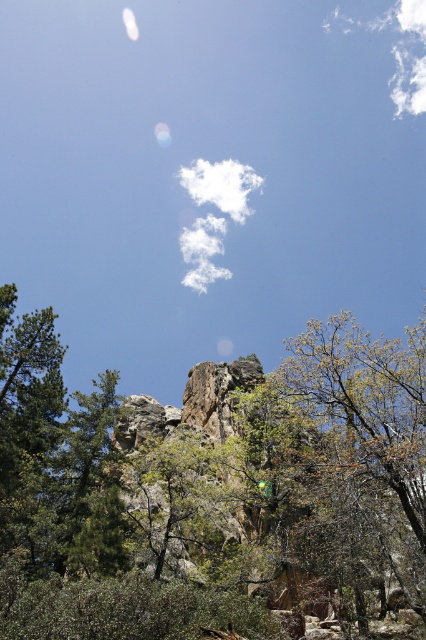
Between green matte tree at left and white fluffy cloud at upper center, which one is positioned higher?

white fluffy cloud at upper center is higher up.

Based on the photo, can you confirm if green matte tree at left is taller than white fluffy cloud at upper center?

In fact, green matte tree at left may be shorter than white fluffy cloud at upper center.

Locate an element on the screen. green matte tree at left is located at coordinates (54, 454).

Can you confirm if green matte tree at left is positioned to the left of white fluffy cloud at upper right?

Yes, green matte tree at left is to the left of white fluffy cloud at upper right.

Is green matte tree at left further to the viewer compared to white fluffy cloud at upper right?

No, green matte tree at left is in front of white fluffy cloud at upper right.

At what (x,y) coordinates should I click in order to perform the action: click on green matte tree at left. Please return your answer as a coordinate pair (x, y). Image resolution: width=426 pixels, height=640 pixels. Looking at the image, I should click on (54, 454).

Identify the location of green matte tree at left. (54, 454).

Is point (210, 200) closer to camera compared to point (408, 51)?

Yes, point (210, 200) is in front of point (408, 51).

Is the position of white fluffy cloud at upper center more distant than that of white fluffy cloud at upper right?

That is False.

Describe the element at coordinates (221, 186) in the screenshot. This screenshot has height=640, width=426. I see `white fluffy cloud at upper center` at that location.

Locate an element on the screen. The image size is (426, 640). white fluffy cloud at upper center is located at coordinates (221, 186).